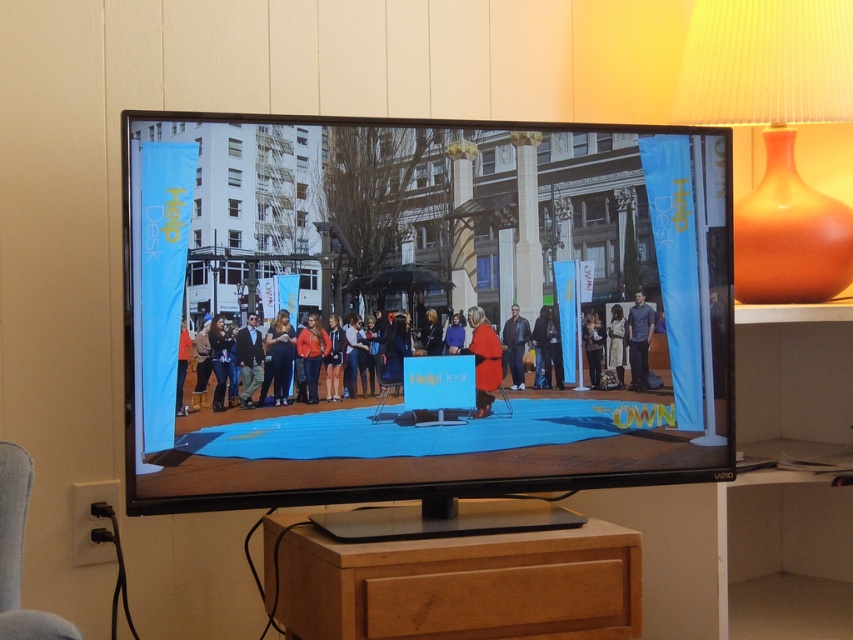
You are a drone operator trying to navigate between two points on a TV screen. The first point is at coordinates point (238, 336) and the second point is at point (306, 394). According to the scene, which point is closer to the camera?

Point (238, 336) is in front of point (306, 394), so it is closer to the camera.

You are a photographer trying to capture a clear shot of both the dark gray suit at center and the matte orange jacket at center in the image. Since you want both subjects to be fully visible, which one should you focus on first to ensure the other remains in the frame?

The dark gray suit at center is taller than the matte orange jacket at center, so you should focus on the dark gray suit at center first. This ensures that the shorter matte orange jacket at center stays within the frame as you adjust your shot.

You need to sit down in the scene shown on the TV screen. There is a gray fabric chair at lower left and dark blue jeans at center. Which one is wider so you can comfortably sit?

The gray fabric chair at lower left is wider than the dark blue jeans at center, so you can comfortably sit on the gray fabric chair at lower left.